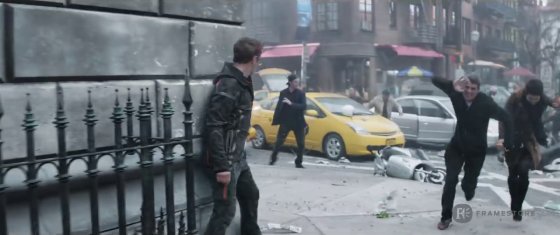
I want to click on brick wall, so click(x=152, y=46).